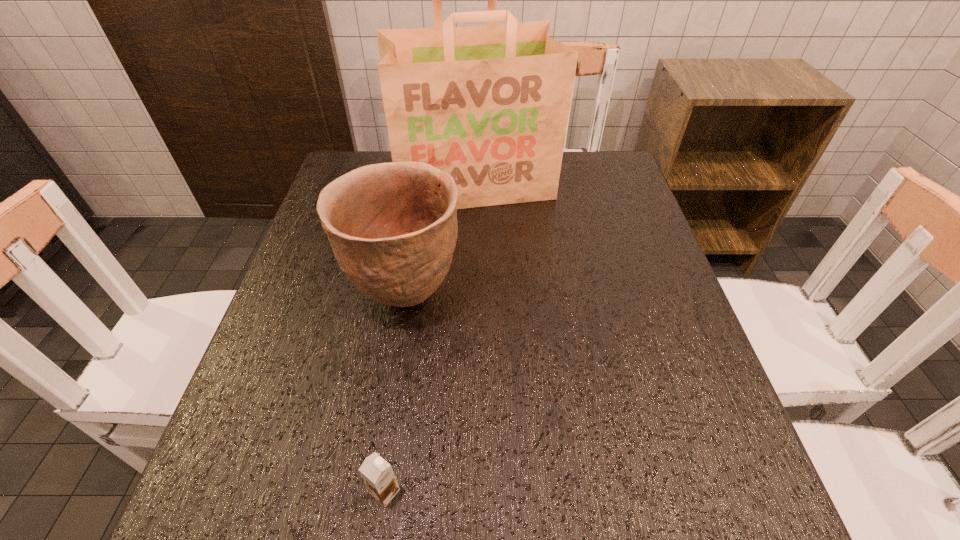
This screenshot has height=540, width=960. In order to click on object that is positioned at the near edge in this screenshot , I will do `click(378, 475)`.

Locate an element on the screen. The image size is (960, 540). object at the left edge is located at coordinates click(392, 227).

Image resolution: width=960 pixels, height=540 pixels. In order to click on free space at the near edge of the desktop in this screenshot , I will do `click(468, 510)`.

I want to click on vacant space at the left edge, so click(252, 388).

At what (x,y) coordinates should I click in order to perform the action: click on vacant area at the right edge of the desktop. Please return your answer as a coordinate pair (x, y). This screenshot has height=540, width=960. Looking at the image, I should click on pyautogui.click(x=642, y=402).

The height and width of the screenshot is (540, 960). In order to click on vacant area at the near left corner of the desktop in this screenshot , I will do `click(229, 530)`.

The width and height of the screenshot is (960, 540). Identify the location of free spot at the far right corner of the desktop. (576, 196).

Where is `vacant region at the near right corner of the desktop`? This screenshot has height=540, width=960. vacant region at the near right corner of the desktop is located at coordinates (714, 494).

Where is `free point between the nearest object and the pottery`? The width and height of the screenshot is (960, 540). free point between the nearest object and the pottery is located at coordinates (396, 393).

Image resolution: width=960 pixels, height=540 pixels. Identify the location of free spot between the second farthest object and the chocolate milk. (396, 393).